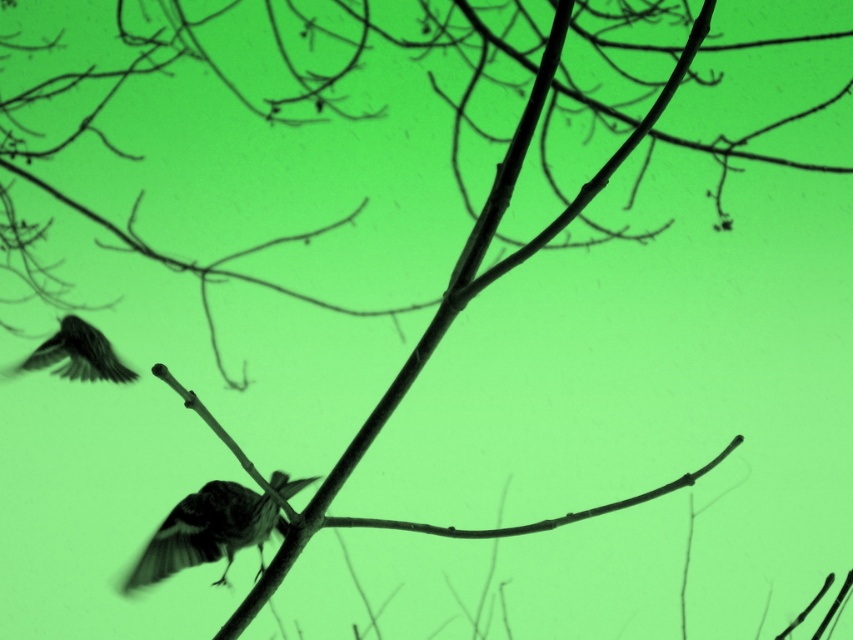
You are an ornithologist observing the scene. You notice a silvery metallic bird at center and silky black feathers at lower left. Which object is positioned to the right of the other?

The silvery metallic bird at center is to the right of silky black feathers at lower left.

You are an ornithologist observing the scene. You notice the silvery metallic bird at center and the silky black feathers at lower left. Which object is taller?

The silvery metallic bird at center is much taller than the silky black feathers at lower left.

You are an ornithologist observing the scene. You notice the silvery metallic bird at center and the silky black feathers at lower left. Which object is wider?

The silvery metallic bird at center is wider than the silky black feathers at lower left.